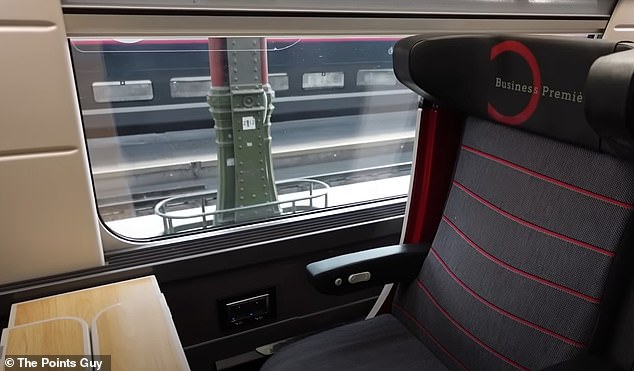
Find the location of `left table extension`. left table extension is located at coordinates (35, 335).